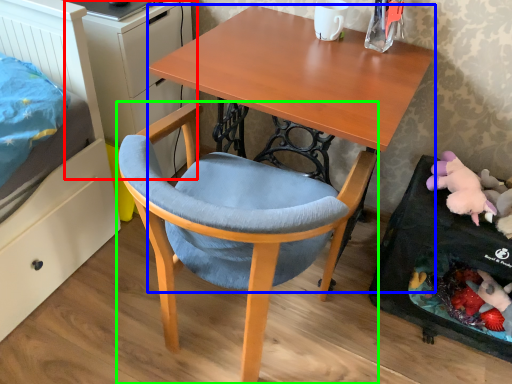
Question: Which object is the farthest from dresser (highlighted by a red box)? Choose among these: desk (highlighted by a blue box) or chair (highlighted by a green box).

Choices:
 (A) desk
 (B) chair

Answer: (B)